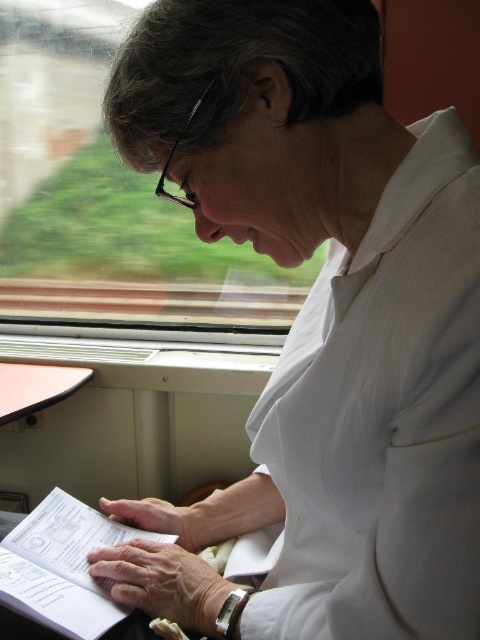
Looking at this image, you are a passenger on a train and want to read the white paper book at lower left while also looking out the transparent glass train window at upper left. Which object is positioned higher in your view?

The transparent glass train window at upper left is located above the white paper book at lower left, so it is positioned higher in your view.

You are a passenger on the train and want to look outside through the transparent glass train window at upper left while holding the white paper book at lower left. Is the window positioned to your left side so you can see outside without letting go of the book?

Yes, the transparent glass train window at upper left is to the left of the white paper book at lower left, so you can hold the white paper book at lower left and still reach the window on your left to look outside without letting go of the book.